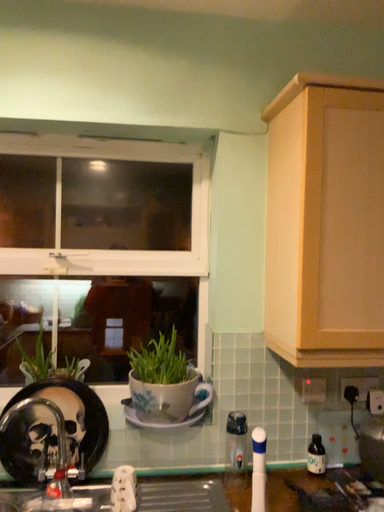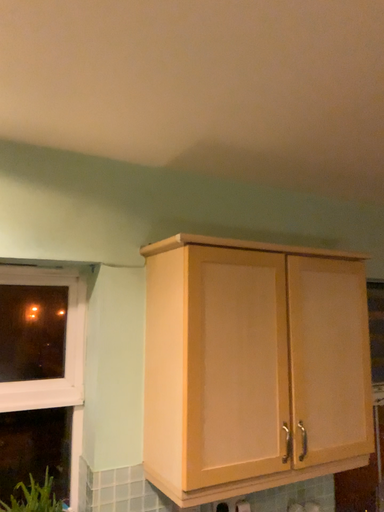
Question: How did the camera likely rotate when shooting the video?

Choices:
 (A) rotated upward
 (B) rotated downward

Answer: (A)